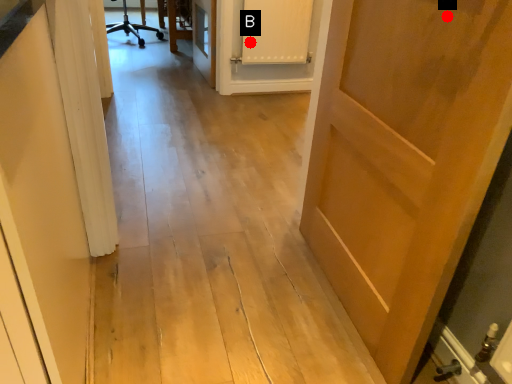
Question: Two points are circled on the image, labeled by A and B beside each circle. Which point is closer to the camera?

Choices:
 (A) A is closer
 (B) B is closer

Answer: (A)